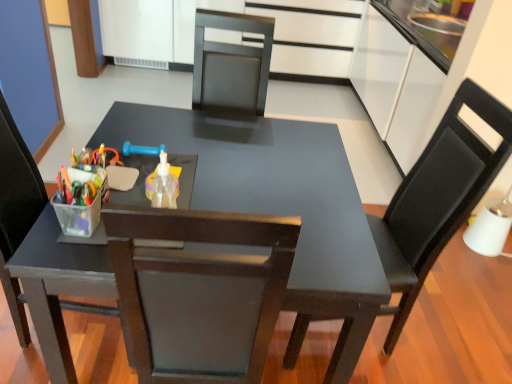
Question: From a real-world perspective, is white glossy drawer at upper center physically located above or below matte black table at center?

Choices:
 (A) below
 (B) above

Answer: (B)

Question: Do you think white glossy drawer at upper center is within matte black table at center, or outside of it?

Choices:
 (A) inside
 (B) outside

Answer: (B)

Question: Estimate the real-world distances between objects in this image. Which object is closer to the matte black chair at left, which is the first chair in left-to-right order?

Choices:
 (A) matte black table at center
 (B) white glossy drawer at upper center
 (C) translucent plastic bottle at center
 (D) matte black chair at right, which is the first chair from right to left

Answer: (A)

Question: Estimate the real-world distances between objects in this image. Which object is closer to the matte black table at center?

Choices:
 (A) white glossy drawer at upper center
 (B) matte black chair at right, which appears as the 2th chair when viewed from the left
 (C) translucent plastic bottle at center
 (D) matte black chair at left, acting as the second chair starting from the right

Answer: (C)